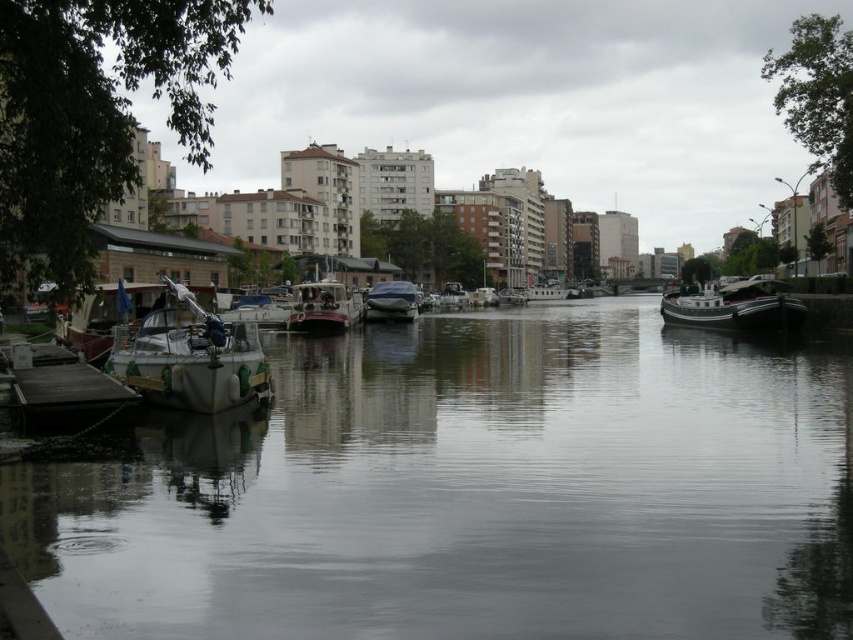
You are a photographer planning to take a photo of the canal scene. You want to ensure that both the white matte sailboat at left and the metallic red boat at center are clearly visible in the frame. Given their sizes, which boat should you focus on first to ensure it fits properly in the composition?

The white matte sailboat at left is larger in size than the metallic red boat at center, so you should focus on the white matte sailboat at left first to ensure it fits properly in the composition.

You are standing at the center of the canal and want to locate the white matte sailboat at left. According to the coordinates given, where would you find it?

The white matte sailboat at left is located at coordinates point (x=190, y=356).

You are standing at the point marked by the coordinates (x=190, y=356) on the left side of the canal. You want to board the white matte sailboat at left. Is it possible to reach the boat from your current position?

The white matte sailboat at left is located at point (x=190, y=356), so yes, you can reach the boat from your current position as you are already at the same coordinates.